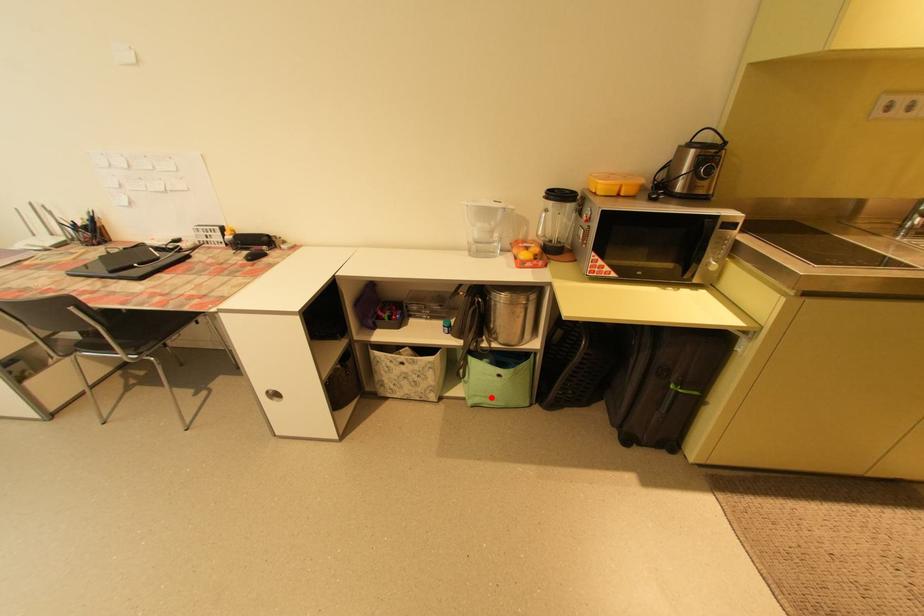
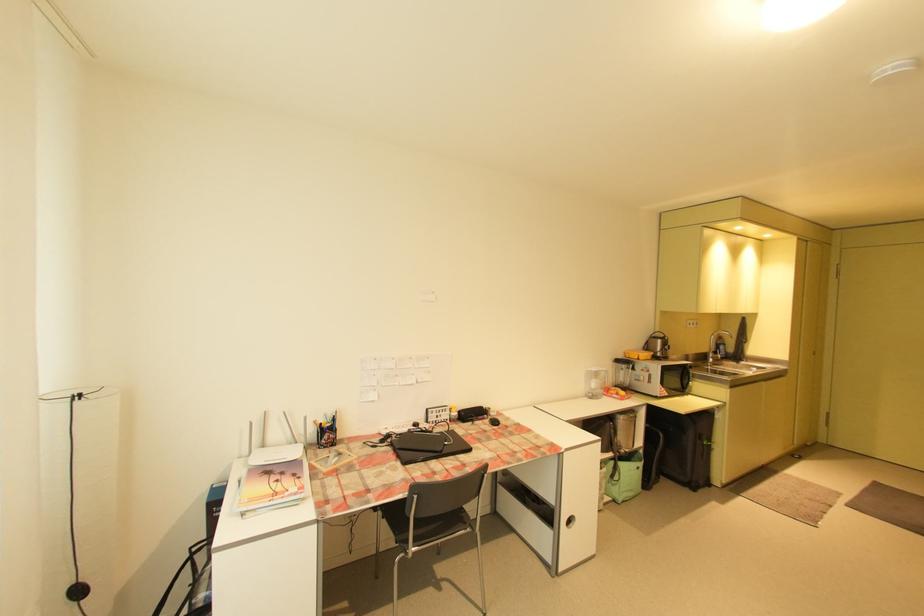
Question: I am providing you with two images of the same scene from different viewpoints. In image1, a red point is highlighted. Considering the same 3D point in image2, which of the following is correct?

Choices:
 (A) It is closer
 (B) It is farther

Answer: (B)